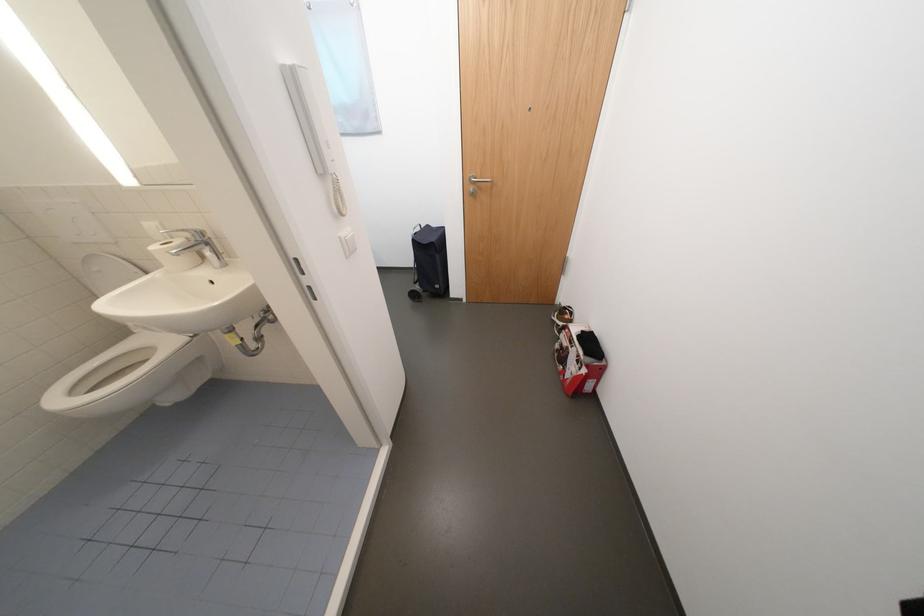
Locate an element on the screen. Image resolution: width=924 pixels, height=616 pixels. silver door handle is located at coordinates (478, 180).